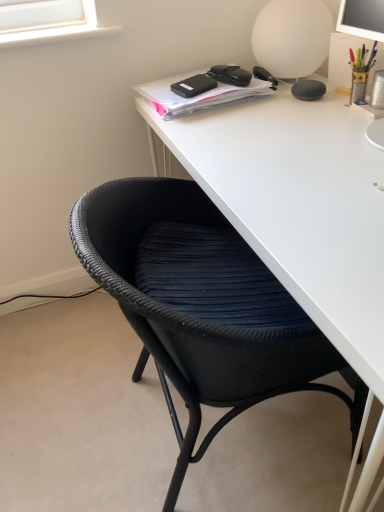
I want to click on free location to the left of matte black speaker at upper right, which is the second stationery from right to left, so click(255, 105).